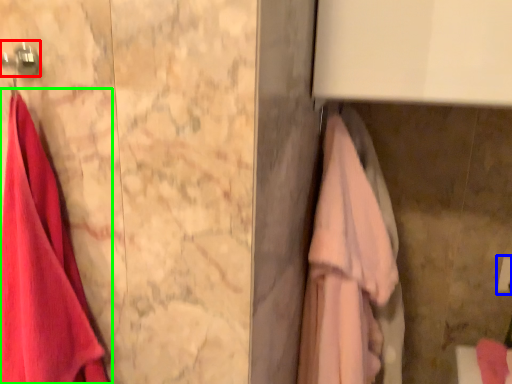
Question: Considering the real-world distances, which object is closest to hanger (highlighted by a red box)? towel bar (highlighted by a blue box) or towel (highlighted by a green box).

Choices:
 (A) towel bar
 (B) towel

Answer: (B)